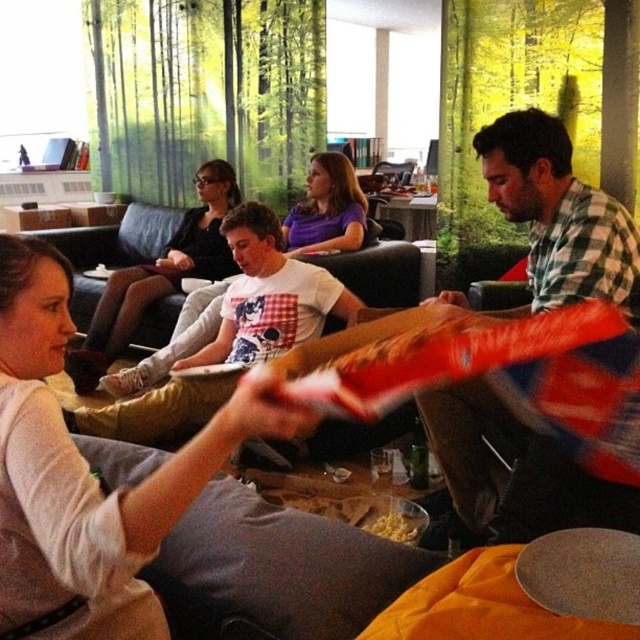
You are sitting on the black leather couch at center and want to hand a book to the person wearing the matte black shirt at center. Which direction should you move to reach them?

The matte black shirt at center is located above the black leather couch at center, so you should move upward to reach them.

You are a delivery robot that needs to place a package between the checkered fabric shirt at right and the black leather couch at center. Can you fit the package in that space if the package is 3 feet wide?

The distance between the checkered fabric shirt at right and the black leather couch at center is 34.74 inches. Since 3 feet equals 36 inches, the package is wider than the available space. The package cannot fit there.